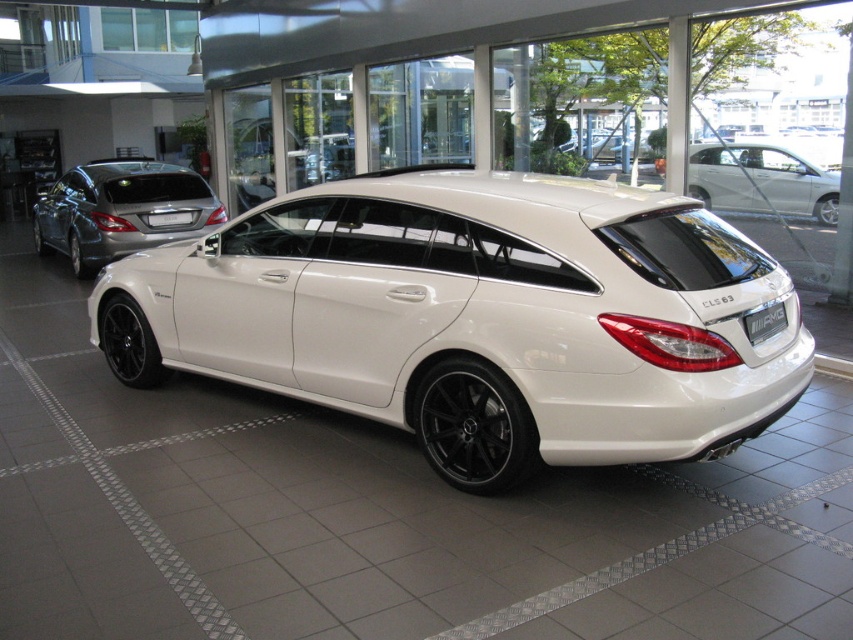
Does black matte rim at lower center have a larger size compared to white matte car at upper right?

Actually, black matte rim at lower center might be smaller than white matte car at upper right.

Between black matte rim at lower center and white matte car at upper right, which one has more height?

white matte car at upper right is taller.

Between point (451, 465) and point (705, 188), which one is positioned in front?

Point (451, 465) is in front.

The image size is (853, 640). Find the location of `black matte rim at lower center`. black matte rim at lower center is located at coordinates (473, 426).

Between point (462, 371) and point (138, 344), which one is positioned in front?

Point (462, 371) is in front.

Is point (479, 358) closer to viewer compared to point (122, 352)?

That is True.

You are a GUI agent. You are given a task and a screenshot of the screen. Output one action in this format:
    pyautogui.click(x=<x>, y=<y>)
    Task: Click on the black matte rim at lower center
    Image resolution: width=853 pixels, height=640 pixels.
    Given the screenshot: What is the action you would take?
    pyautogui.click(x=473, y=426)

Is white glossy car at center further to the viewer compared to white matte car at upper right?

No, it is not.

Between white glossy car at center and white matte car at upper right, which one is positioned higher?

white matte car at upper right

Between point (686, 269) and point (820, 205), which one is positioned in front?

Point (686, 269) is more forward.

I want to click on white glossy car at center, so click(x=488, y=316).